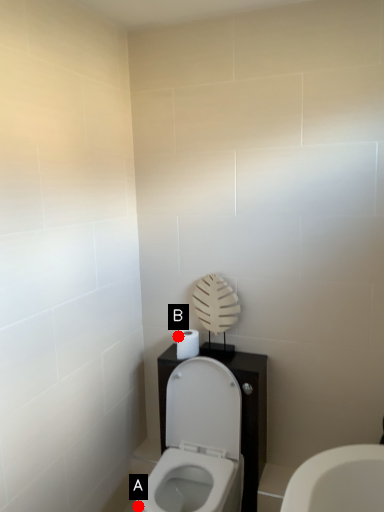
Question: Two points are circled on the image, labeled by A and B beside each circle. Which point is closer to the camera?

Choices:
 (A) A is closer
 (B) B is closer

Answer: (A)